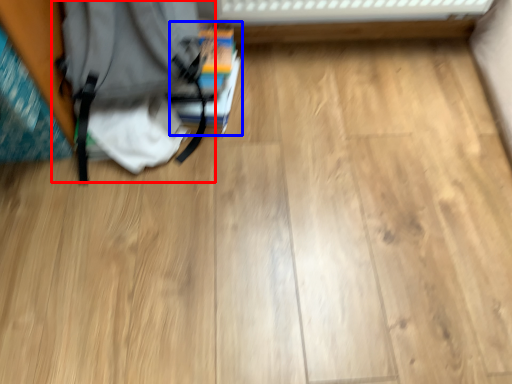
Question: Among these objects, which one is nearest to the camera, backpack (highlighted by a red box) or book (highlighted by a blue box)?

Choices:
 (A) backpack
 (B) book

Answer: (A)